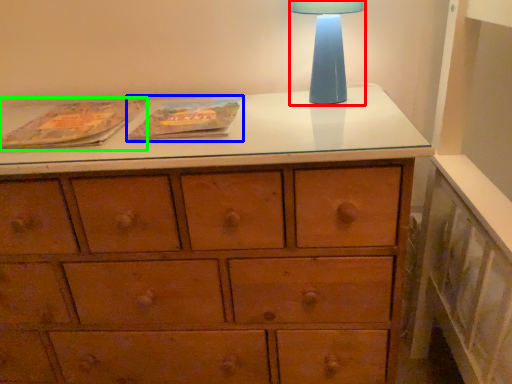
Question: Which object is positioned closest to table lamp (highlighted by a red box)? Select from paperback book (highlighted by a blue box) and paperback book (highlighted by a green box).

Choices:
 (A) paperback book
 (B) paperback book

Answer: (A)